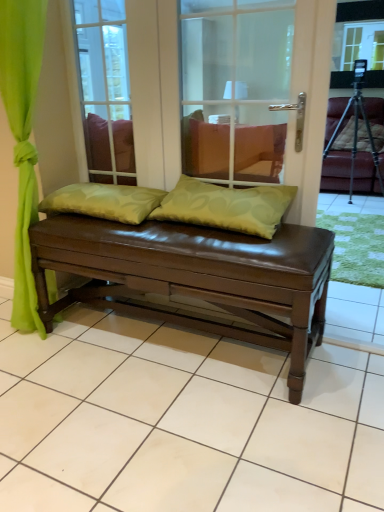
This screenshot has width=384, height=512. Identify the location of leather armchair at right. (336, 170).

The image size is (384, 512). Describe the element at coordinates (226, 206) in the screenshot. I see `green fabric pillow at center, acting as the first pillow starting from the right` at that location.

Identify the location of transparent glass window screen at upper center. (358, 42).

Can you confirm if green fabric pillow at center, the 1th pillow viewed from the left, is bigger than transparent glass door at center?

Incorrect, green fabric pillow at center, the 1th pillow viewed from the left, is not larger than transparent glass door at center.

Could transparent glass door at center be considered to be inside green fabric pillow at center, which ranks as the second pillow in right-to-left order?

No, green fabric pillow at center, which ranks as the second pillow in right-to-left order, does not contain transparent glass door at center.

Is point (47, 212) closer to viewer compared to point (107, 17)?

That is True.

Between green fabric pillow at center, the 1th pillow viewed from the left, and transparent glass door at center, which one has more height?

With more height is transparent glass door at center.

Considering the sizes of green fabric pillow at center, the 2th pillow when ordered from left to right, and transparent glass door at center in the image, is green fabric pillow at center, the 2th pillow when ordered from left to right, taller or shorter than transparent glass door at center?

Clearly, green fabric pillow at center, the 2th pillow when ordered from left to right, is shorter compared to transparent glass door at center.

Does point (278, 223) come closer to viewer compared to point (96, 17)?

Yes, point (278, 223) is in front of point (96, 17).

Which is more to the right, green fabric pillow at center, acting as the first pillow starting from the right, or transparent glass door at center?

Positioned to the right is green fabric pillow at center, acting as the first pillow starting from the right.

Is green fabric pillow at center, the 2th pillow when ordered from left to right, facing towards transparent glass door at center?

No, green fabric pillow at center, the 2th pillow when ordered from left to right, is not aimed at transparent glass door at center.

Is there a large distance between green fabric pillow at center, the 1th pillow viewed from the left, and brown leather bench at center?

No.

How much distance is there between green fabric pillow at center, which ranks as the second pillow in right-to-left order, and brown leather bench at center?

green fabric pillow at center, which ranks as the second pillow in right-to-left order, is 34.43 centimeters from brown leather bench at center.

Is point (44, 212) closer to viewer compared to point (258, 282)?

No.

In terms of size, does green fabric pillow at center, the 1th pillow viewed from the left, appear bigger or smaller than brown leather bench at center?

Clearly, green fabric pillow at center, the 1th pillow viewed from the left, is smaller in size than brown leather bench at center.

From the image's perspective, is brown leather bench at center above green fabric pillow at center, which ranks as the second pillow in right-to-left order?

Incorrect, from the image's perspective, brown leather bench at center is lower than green fabric pillow at center, which ranks as the second pillow in right-to-left order.

Can you confirm if brown leather bench at center is smaller than green fabric pillow at center, which ranks as the second pillow in right-to-left order?

Incorrect, brown leather bench at center is not smaller in size than green fabric pillow at center, which ranks as the second pillow in right-to-left order.

Consider the image. Is brown leather bench at center positioned in front of green fabric pillow at center, the 1th pillow viewed from the left?

Yes, brown leather bench at center is closer to the viewer.

Visually, is green fabric pillow at center, the 2th pillow when ordered from left to right, positioned to the left or to the right of brown leather bench at center?

Based on their positions, green fabric pillow at center, the 2th pillow when ordered from left to right, is located to the left of brown leather bench at center.

From the image's perspective, is green fabric pillow at center, acting as the first pillow starting from the right, located beneath brown leather bench at center?

Indeed, from the image's perspective, green fabric pillow at center, acting as the first pillow starting from the right, is shown beneath brown leather bench at center.

Is point (170, 206) positioned after point (257, 26)?

Yes, it is.

Is green fabric pillow at center, the 2th pillow when ordered from left to right, turned away from brown leather bench at center?

Absolutely, green fabric pillow at center, the 2th pillow when ordered from left to right, is directed away from brown leather bench at center.

Is brown leather bench at center directly adjacent to transparent glass window screen at upper center?

No, brown leather bench at center is not beside transparent glass window screen at upper center.

How different are the orientations of brown leather bench at center and transparent glass window screen at upper center in degrees?

The facing directions of brown leather bench at center and transparent glass window screen at upper center are 1.62 degrees apart.

Find the location of `studio couch below the transparent glass window screen at upper center (from the image's perspective)`. studio couch below the transparent glass window screen at upper center (from the image's perspective) is located at coordinates (194, 276).

Between brown leather bench at center and transparent glass window screen at upper center, which one is positioned in front?

Positioned in front is brown leather bench at center.

Measure the distance from green fabric pillow at center, which ranks as the second pillow in right-to-left order, to green fabric pillow at center, the 2th pillow when ordered from left to right.

green fabric pillow at center, which ranks as the second pillow in right-to-left order, is 11.37 inches from green fabric pillow at center, the 2th pillow when ordered from left to right.

Consider the image. Is green fabric pillow at center, the 1th pillow viewed from the left, not inside green fabric pillow at center, the 2th pillow when ordered from left to right?

That's correct, green fabric pillow at center, the 1th pillow viewed from the left, is outside of green fabric pillow at center, the 2th pillow when ordered from left to right.

Is green fabric pillow at center, the 1th pillow viewed from the left, next to green fabric pillow at center, acting as the first pillow starting from the right, and touching it?

No.

From a real-world perspective, is green fabric pillow at center, the 1th pillow viewed from the left, on top of green fabric pillow at center, acting as the first pillow starting from the right?

No, from a real-world perspective, green fabric pillow at center, the 1th pillow viewed from the left, is not over green fabric pillow at center, acting as the first pillow starting from the right

There is a transparent glass door at center. Find the location of `the 2nd pillow below it (from a real-world perspective)`. the 2nd pillow below it (from a real-world perspective) is located at coordinates (104, 201).

There is a green fabric pillow at center, acting as the first pillow starting from the right. Where is `glass door above it (from a real-world perspective)`? This screenshot has height=512, width=384. glass door above it (from a real-world perspective) is located at coordinates (105, 90).

Which object lies nearer to the anchor point transparent glass window screen at upper center, brown leather bench at center or leather armchair at right?

leather armchair at right is positioned closer to the anchor transparent glass window screen at upper center.

In the scene shown: When comparing their distances from brown leather bench at center, does brown leather bench at center or transparent glass door at center seem closer?

brown leather bench at center is positioned closer to the anchor brown leather bench at center.

Considering their positions, is leather armchair at right positioned closer to transparent glass door at center than brown leather bench at center?

brown leather bench at center lies closer to transparent glass door at center than the other object.

Estimate the real-world distances between objects in this image. Which object is further from brown leather bench at center, transparent glass window screen at upper center or transparent glass door at center?

Among the two, transparent glass window screen at upper center is located further to brown leather bench at center.

Based on their spatial positions, is transparent glass window screen at upper center or transparent glass door at center closer to brown leather bench at center?

transparent glass door at center.

From the image, which object appears to be nearer to green fabric pillow at center, the 1th pillow viewed from the left, green fabric pillow at center, the 2th pillow when ordered from left to right, or brown leather bench at center?

green fabric pillow at center, the 2th pillow when ordered from left to right, lies closer to green fabric pillow at center, the 1th pillow viewed from the left, than the other object.

Estimate the real-world distances between objects in this image. Which object is further from brown leather bench at center, green fabric pillow at center, the 2th pillow when ordered from left to right, or leather armchair at right?

leather armchair at right is positioned further to the anchor brown leather bench at center.

From the image, which object appears to be nearer to transparent glass window screen at upper center, green fabric pillow at center, the 2th pillow when ordered from left to right, or brown leather bench at center?

green fabric pillow at center, the 2th pillow when ordered from left to right, is positioned closer to the anchor transparent glass window screen at upper center.

Find the location of `pillow between green fabric pillow at center, the 2th pillow when ordered from left to right, and leather armchair at right from front to back`. pillow between green fabric pillow at center, the 2th pillow when ordered from left to right, and leather armchair at right from front to back is located at coordinates (104, 201).

The image size is (384, 512). Identify the location of glass door between brown leather bench at center and leather armchair at right along the z-axis. point(105,90).

The width and height of the screenshot is (384, 512). Find the location of `pillow between green fabric pillow at center, the 1th pillow viewed from the left, and brown leather bench at center`. pillow between green fabric pillow at center, the 1th pillow viewed from the left, and brown leather bench at center is located at coordinates (226, 206).

In order to click on glass door between brown leather bench at center and leather armchair at right along the z-axis in this screenshot , I will do `click(105, 90)`.